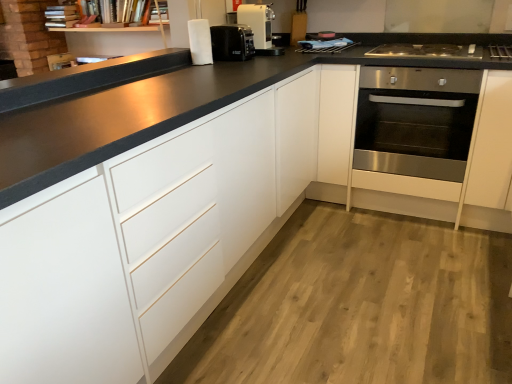
Question: Is stainless steel oven at right facing away from stainless steel gas stove at right?

Choices:
 (A) no
 (B) yes

Answer: (A)

Question: Is stainless steel oven at right completely or partially outside of stainless steel gas stove at right?

Choices:
 (A) no
 (B) yes

Answer: (B)

Question: From a real-world perspective, is stainless steel oven at right located higher than stainless steel gas stove at right?

Choices:
 (A) yes
 (B) no

Answer: (B)

Question: Does stainless steel oven at right appear on the left side of stainless steel gas stove at right?

Choices:
 (A) yes
 (B) no

Answer: (B)

Question: Would you say stainless steel oven at right is a long distance from stainless steel gas stove at right?

Choices:
 (A) yes
 (B) no

Answer: (B)

Question: In terms of size, does white plastic coffee machine at upper center appear bigger or smaller than stainless steel gas stove at right?

Choices:
 (A) small
 (B) big

Answer: (A)

Question: Is point (239, 18) closer or farther from the camera than point (444, 54)?

Choices:
 (A) closer
 (B) farther

Answer: (B)

Question: From a real-world perspective, is white plastic coffee machine at upper center physically located above or below stainless steel gas stove at right?

Choices:
 (A) below
 (B) above

Answer: (B)

Question: From the image's perspective, relative to stainless steel gas stove at right, is white plastic coffee machine at upper center above or below?

Choices:
 (A) below
 (B) above

Answer: (B)

Question: Looking at their shapes, would you say black plastic coffee machine at upper center is wider or thinner than stainless steel oven at right?

Choices:
 (A) wide
 (B) thin

Answer: (B)

Question: Considering their positions, is black plastic coffee machine at upper center located in front of or behind stainless steel oven at right?

Choices:
 (A) behind
 (B) front

Answer: (A)

Question: Is point (248, 36) closer or farther from the camera than point (436, 99)?

Choices:
 (A) farther
 (B) closer

Answer: (A)

Question: Is black plastic coffee machine at upper center to the left or to the right of stainless steel oven at right in the image?

Choices:
 (A) right
 (B) left

Answer: (B)

Question: Considering the positions of point (373, 54) and point (236, 23), is point (373, 54) closer or farther from the camera than point (236, 23)?

Choices:
 (A) closer
 (B) farther

Answer: (A)

Question: Do you think stainless steel gas stove at right is within black plastic coffee machine at upper center, or outside of it?

Choices:
 (A) inside
 (B) outside

Answer: (B)